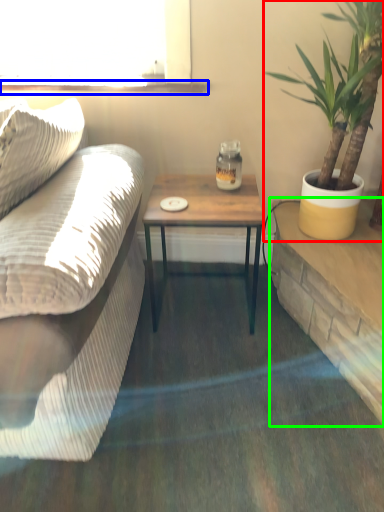
Question: Which is nearer to the houseplant (highlighted by a red box)? window sill (highlighted by a blue box) or table (highlighted by a green box).

Choices:
 (A) window sill
 (B) table

Answer: (B)